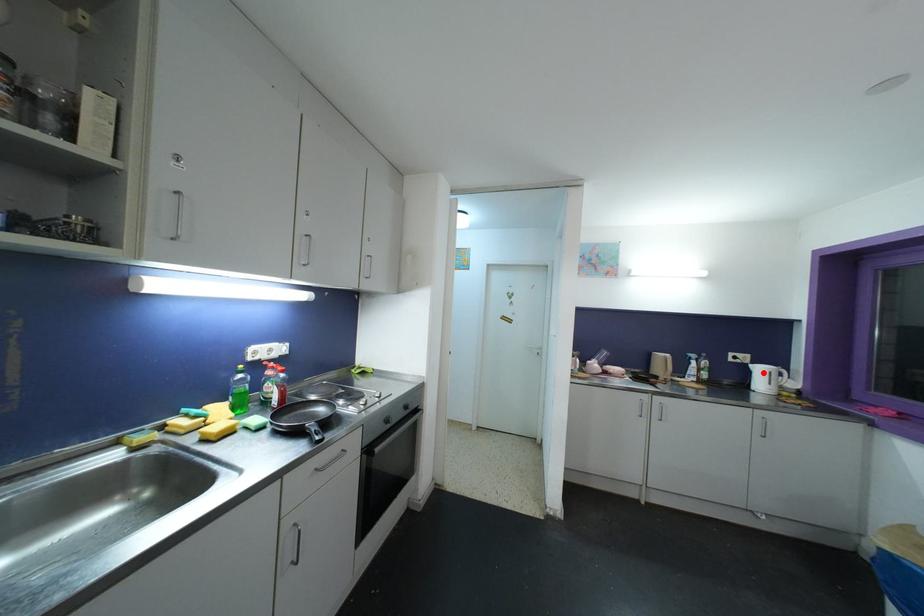
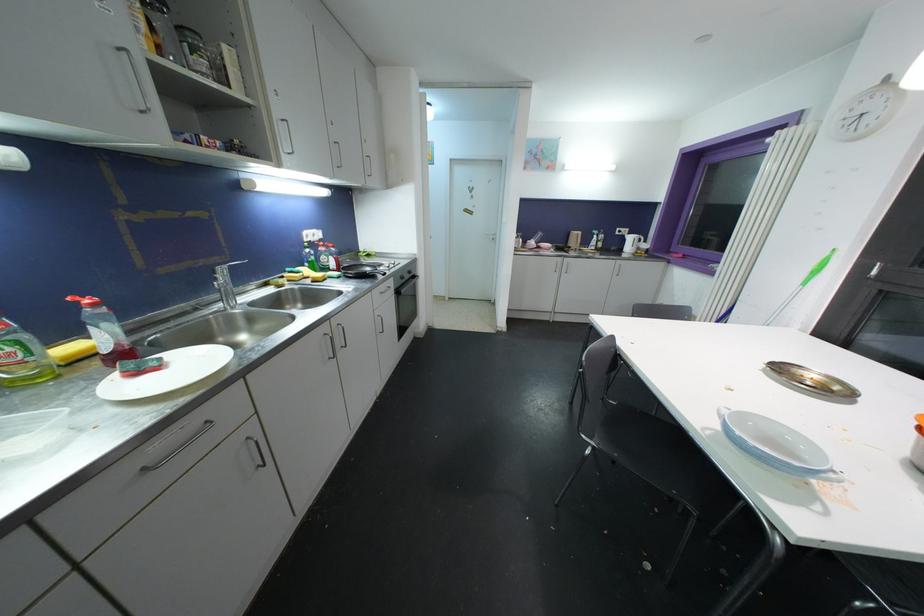
Where in the second image is the point corresponding to the highlighted location from the first image?

(634, 241)